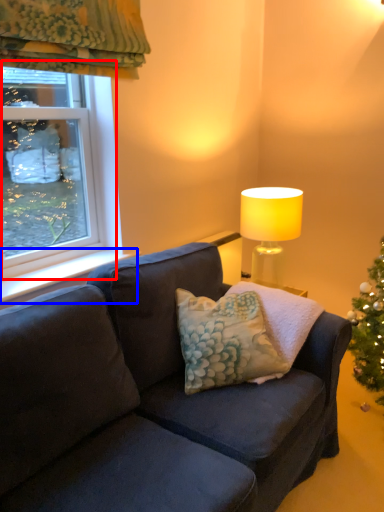
Question: Which point is closer to the camera, window (highlighted by a red box) or window sill (highlighted by a blue box)?

Choices:
 (A) window
 (B) window sill

Answer: (A)